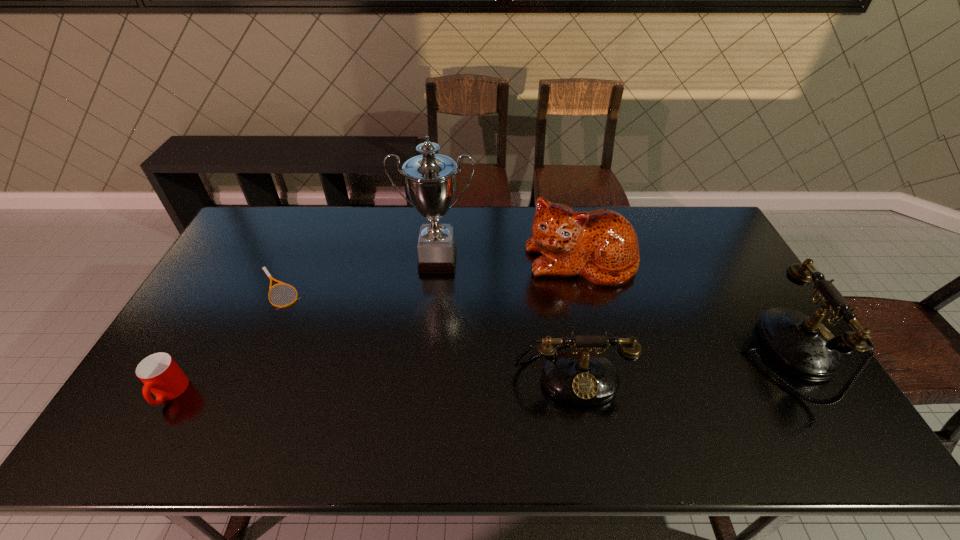
The width and height of the screenshot is (960, 540). I want to click on free space for a new telephone on the left, so click(x=335, y=394).